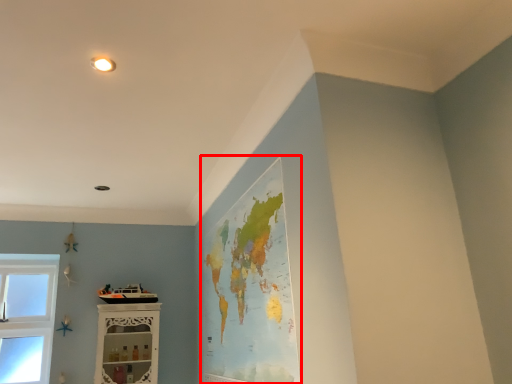
Question: From the image's perspective, where is map (annotated by the red box) located in relation to shelf in the image?

Choices:
 (A) above
 (B) below

Answer: (A)